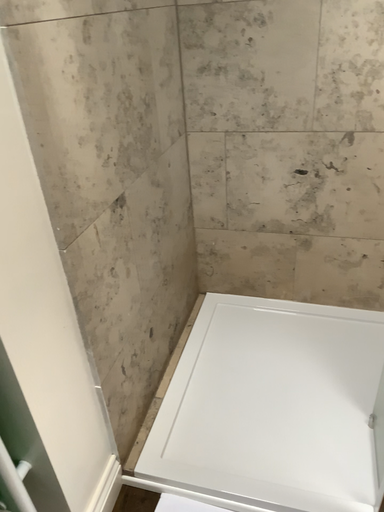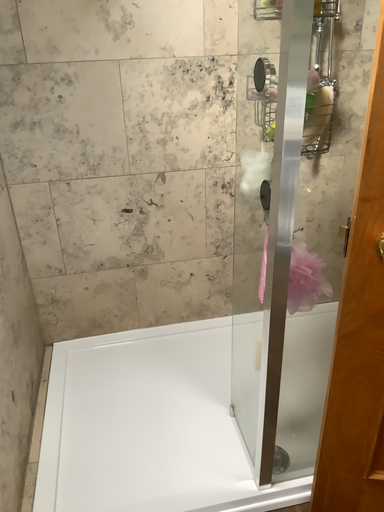
Question: Which way did the camera rotate in the video?

Choices:
 (A) rotated upward
 (B) rotated downward

Answer: (A)